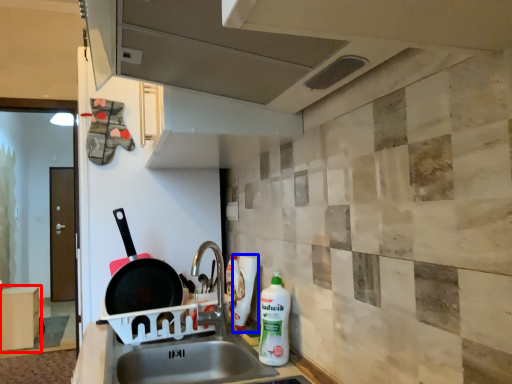
Question: Which object is closer to the camera taking this photo, cabinetry (highlighted by a red box) or bottle (highlighted by a blue box)?

Choices:
 (A) cabinetry
 (B) bottle

Answer: (B)